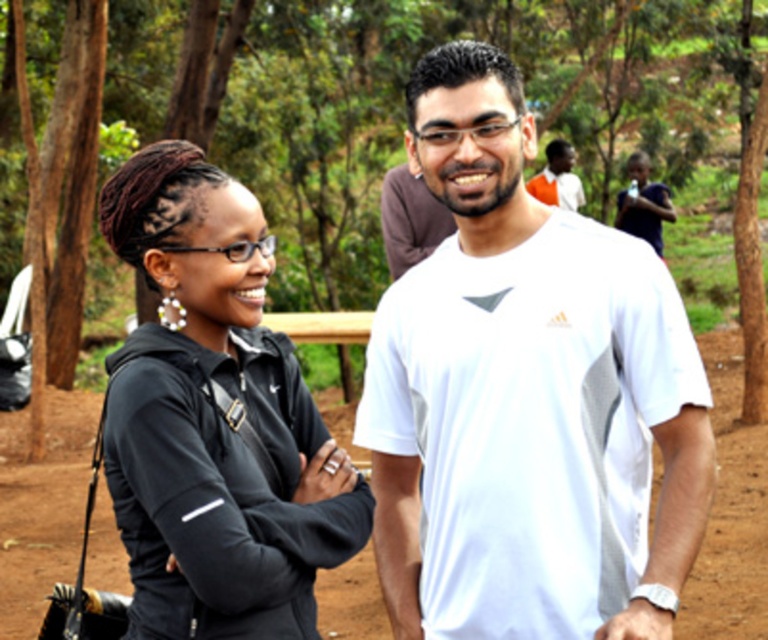
Question: Is white matte t-shirt at center below orange cotton shirt at upper right?

Choices:
 (A) yes
 (B) no

Answer: (A)

Question: Estimate the real-world distances between objects in this image. Which object is farther from the orange cotton shirt at upper right?

Choices:
 (A) white matte t-shirt at center
 (B) black matte jacket at center

Answer: (B)

Question: Can you confirm if white matte t-shirt at center is positioned to the left of black matte jacket at center?

Choices:
 (A) no
 (B) yes

Answer: (A)

Question: Which point appears closest to the camera in this image?

Choices:
 (A) (571, 148)
 (B) (138, 625)
 (C) (531, 632)

Answer: (B)

Question: Is white matte t-shirt at center below black matte jacket at center?

Choices:
 (A) yes
 (B) no

Answer: (B)

Question: Which point is farther from the camera taking this photo?

Choices:
 (A) (593, 220)
 (B) (169, 179)
 (C) (555, 170)

Answer: (C)